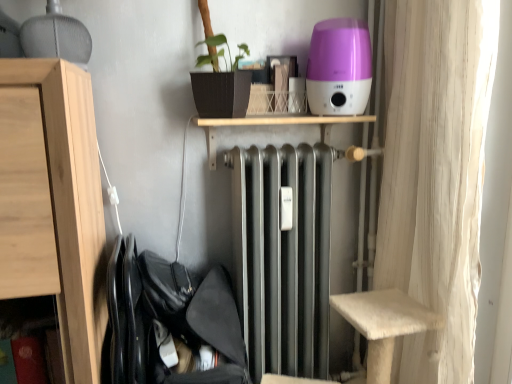
Question: Is black fabric laundry at lower left closer to the viewer compared to metallic silver radiator at center?

Choices:
 (A) yes
 (B) no

Answer: (A)

Question: From the image's perspective, is black fabric laundry at lower left beneath metallic silver radiator at center?

Choices:
 (A) yes
 (B) no

Answer: (A)

Question: Is black fabric laundry at lower left looking in the opposite direction of metallic silver radiator at center?

Choices:
 (A) no
 (B) yes

Answer: (A)

Question: Is black fabric laundry at lower left positioned behind metallic silver radiator at center?

Choices:
 (A) yes
 (B) no

Answer: (B)

Question: Would you say black fabric laundry at lower left contains metallic silver radiator at center?

Choices:
 (A) no
 (B) yes

Answer: (A)

Question: Choose the correct answer: Is light wood cabinet at left inside purple glossy humidifier at upper center or outside it?

Choices:
 (A) inside
 (B) outside

Answer: (B)

Question: Visually, is light wood cabinet at left positioned to the left or to the right of purple glossy humidifier at upper center?

Choices:
 (A) right
 (B) left

Answer: (B)

Question: Considering their positions, is light wood cabinet at left located in front of or behind purple glossy humidifier at upper center?

Choices:
 (A) front
 (B) behind

Answer: (A)

Question: In terms of size, does light wood cabinet at left appear bigger or smaller than purple glossy humidifier at upper center?

Choices:
 (A) big
 (B) small

Answer: (A)

Question: From the image's perspective, is black fabric laundry at lower left positioned above or below light wood cabinet at left?

Choices:
 (A) above
 (B) below

Answer: (B)

Question: Relative to light wood cabinet at left, is black fabric laundry at lower left in front or behind?

Choices:
 (A) behind
 (B) front

Answer: (A)

Question: From a real-world perspective, is black fabric laundry at lower left positioned above or below light wood cabinet at left?

Choices:
 (A) above
 (B) below

Answer: (B)

Question: Is black fabric laundry at lower left wider or thinner than light wood cabinet at left?

Choices:
 (A) wide
 (B) thin

Answer: (B)

Question: From a real-world perspective, is metallic silver radiator at center above or below white textured curtain at right?

Choices:
 (A) above
 (B) below

Answer: (A)

Question: From their relative heights in the image, would you say metallic silver radiator at center is taller or shorter than white textured curtain at right?

Choices:
 (A) short
 (B) tall

Answer: (A)